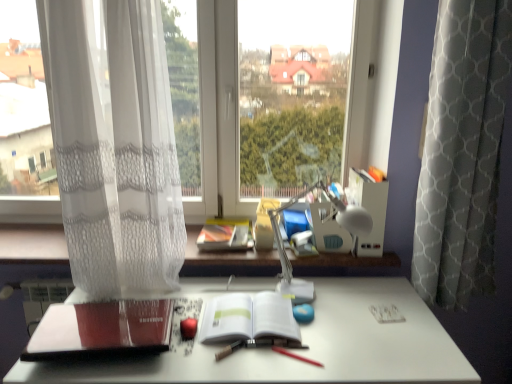
Image resolution: width=512 pixels, height=384 pixels. What do you see at coordinates (303, 351) in the screenshot?
I see `white matte desk at center` at bounding box center [303, 351].

I want to click on gray textured curtain at right, marked as the 1th curtain in a right-to-left arrangement, so click(462, 151).

What do you see at coordinates (462, 151) in the screenshot?
I see `gray textured curtain at right, marked as the 1th curtain in a right-to-left arrangement` at bounding box center [462, 151].

Describe the element at coordinates (339, 225) in the screenshot. I see `white plastic table lamp at center` at that location.

Describe the element at coordinates (218, 113) in the screenshot. The image size is (512, 384). I see `transparent glass window at center` at that location.

Locate an element on the screen. The width and height of the screenshot is (512, 384). white matte desk at center is located at coordinates (303, 351).

From a real-world perspective, between white plastic table lamp at center and gray textured curtain at right, marked as the 1th curtain in a right-to-left arrangement, who is vertically lower?

white plastic table lamp at center.

Is gray textured curtain at right, which is counted as the second curtain, starting from the left, located within white plastic table lamp at center?

That's incorrect, gray textured curtain at right, which is counted as the second curtain, starting from the left, is not inside white plastic table lamp at center.

Image resolution: width=512 pixels, height=384 pixels. I want to click on curtain that is the 1st one when counting upward from the white plastic table lamp at center (from the image's perspective), so click(x=462, y=151).

From a real-world perspective, does red matte book at lower left, positioned as the 1th paperback book in left-to-right order, sit lower than white sheer curtain at left, positioned as the first curtain in left-to-right order?

Correct, in the physical world, red matte book at lower left, positioned as the 1th paperback book in left-to-right order, is lower than white sheer curtain at left, positioned as the first curtain in left-to-right order.

Between red matte book at lower left, positioned as the 1th paperback book in left-to-right order, and white sheer curtain at left, positioned as the first curtain in left-to-right order, which one has larger width?

red matte book at lower left, positioned as the 1th paperback book in left-to-right order, is wider.

Do you think red matte book at lower left, positioned as the 1th paperback book in left-to-right order, is within white sheer curtain at left, positioned as the first curtain in left-to-right order, or outside of it?

The correct answer is: outside.

Considering the relative positions of red matte book at lower left, marked as the 2th paperback book in a right-to-left arrangement, and white sheer curtain at left, positioned as the first curtain in left-to-right order, in the image provided, is red matte book at lower left, marked as the 2th paperback book in a right-to-left arrangement, behind white sheer curtain at left, positioned as the first curtain in left-to-right order,?

No, red matte book at lower left, marked as the 2th paperback book in a right-to-left arrangement, is closer to the camera.

From a real-world perspective, is white matte desk at center above or below smooth red crayon at center?

In terms of real-world spatial position, white matte desk at center is below smooth red crayon at center.

Is white matte desk at center facing towards smooth red crayon at center?

No, white matte desk at center is not aimed at smooth red crayon at center.

Is point (80, 292) positioned behind point (301, 356)?

Yes, point (80, 292) is farther from viewer.

In the scene shown: Between white matte desk at center and smooth red crayon at center, which one has larger width?

white matte desk at center.

The height and width of the screenshot is (384, 512). Find the location of `table lamp lying above the white paper at center, placed as the 1th paperback book when sorted from right to left (from the image's perspective)`. table lamp lying above the white paper at center, placed as the 1th paperback book when sorted from right to left (from the image's perspective) is located at coordinates (339, 225).

From the image's perspective, who appears lower, white paper at center, placed as the 1th paperback book when sorted from right to left, or white plastic table lamp at center?

white paper at center, placed as the 1th paperback book when sorted from right to left, appears lower in the image.

Is point (273, 296) behind point (332, 195)?

No, (273, 296) is in front of (332, 195).

Can you tell me how much white paper at center, marked as the 2th paperback book in a left-to-right arrangement, and white plastic table lamp at center differ in facing direction?

The angular difference between white paper at center, marked as the 2th paperback book in a left-to-right arrangement, and white plastic table lamp at center is 0.971 degrees.

Is transparent glass window at center facing towards red matte book at lower left, positioned as the 1th paperback book in left-to-right order?

Yes, transparent glass window at center is facing red matte book at lower left, positioned as the 1th paperback book in left-to-right order.

Which is closer, (x=211, y=23) or (x=113, y=332)?

Point (x=211, y=23) is farther from the camera than point (x=113, y=332).

Is transparent glass window at center at the left side of red matte book at lower left, positioned as the 1th paperback book in left-to-right order?

In fact, transparent glass window at center is to the right of red matte book at lower left, positioned as the 1th paperback book in left-to-right order.

Based on the photo, are transparent glass window at center and red matte book at lower left, marked as the 2th paperback book in a right-to-left arrangement, far apart?

They are positioned close to each other.

Is gray textured curtain at right, marked as the 1th curtain in a right-to-left arrangement, oriented away from smooth red crayon at center?

That's not correct — gray textured curtain at right, marked as the 1th curtain in a right-to-left arrangement, is not looking away from smooth red crayon at center.

Does gray textured curtain at right, marked as the 1th curtain in a right-to-left arrangement, have a larger size compared to smooth red crayon at center?

Correct, gray textured curtain at right, marked as the 1th curtain in a right-to-left arrangement, is larger in size than smooth red crayon at center.

Would you consider gray textured curtain at right, marked as the 1th curtain in a right-to-left arrangement, to be distant from smooth red crayon at center?

That's not correct — gray textured curtain at right, marked as the 1th curtain in a right-to-left arrangement, is a little close to smooth red crayon at center.

Based on the photo, which object is closer to the camera taking this photo, gray textured curtain at right, which is counted as the second curtain, starting from the left, or smooth red crayon at center?

gray textured curtain at right, which is counted as the second curtain, starting from the left.

Is white paper at center, placed as the 1th paperback book when sorted from right to left, not inside red matte book at lower left, marked as the 2th paperback book in a right-to-left arrangement?

white paper at center, placed as the 1th paperback book when sorted from right to left, is positioned outside red matte book at lower left, marked as the 2th paperback book in a right-to-left arrangement.

Does point (208, 310) come farther from viewer compared to point (78, 356)?

Yes, point (208, 310) is farther from viewer.

Image resolution: width=512 pixels, height=384 pixels. Identify the location of paperback book below the red matte book at lower left, marked as the 2th paperback book in a right-to-left arrangement (from a real-world perspective). (249, 318).

Are white paper at center, placed as the 1th paperback book when sorted from right to left, and red matte book at lower left, marked as the 2th paperback book in a right-to-left arrangement, making contact?

No, white paper at center, placed as the 1th paperback book when sorted from right to left, is not next to red matte book at lower left, marked as the 2th paperback book in a right-to-left arrangement.

You are a GUI agent. You are given a task and a screenshot of the screen. Output one action in this format:
    pyautogui.click(x=<x>, y=<y>)
    Task: Click on the 1st curtain located above the white plastic table lamp at center (from a real-world perspective)
    
    Given the screenshot: What is the action you would take?
    pyautogui.click(x=462, y=151)

At what (x,y) coordinates should I click in order to perform the action: click on the 1st curtain to the right when counting from the red matte book at lower left, marked as the 2th paperback book in a right-to-left arrangement. Please return your answer as a coordinate pair (x, y). The height and width of the screenshot is (384, 512). Looking at the image, I should click on (114, 144).

From the image, which object appears to be nearer to white paper at center, marked as the 2th paperback book in a left-to-right arrangement, white sheer curtain at left, the second curtain from the right, or white plastic table lamp at center?

Based on the image, white plastic table lamp at center appears to be nearer to white paper at center, marked as the 2th paperback book in a left-to-right arrangement.

Considering their positions, is white matte desk at center positioned closer to white paper at center, marked as the 2th paperback book in a left-to-right arrangement, than white plastic table lamp at center?

white matte desk at center is closer to white paper at center, marked as the 2th paperback book in a left-to-right arrangement.

Looking at the image, which one is located closer to smooth red crayon at center, white plastic table lamp at center or transparent glass window at center?

Among the two, white plastic table lamp at center is located nearer to smooth red crayon at center.

Considering their positions, is gray textured curtain at right, marked as the 1th curtain in a right-to-left arrangement, positioned further to transparent glass window at center than red matte book at lower left, positioned as the 1th paperback book in left-to-right order?

Among the two, gray textured curtain at right, marked as the 1th curtain in a right-to-left arrangement, is located further to transparent glass window at center.

Looking at the image, which one is located closer to white paper at center, placed as the 1th paperback book when sorted from right to left, white sheer curtain at left, the second curtain from the right, or gray textured curtain at right, which is counted as the second curtain, starting from the left?

Among the two, white sheer curtain at left, the second curtain from the right, is located nearer to white paper at center, placed as the 1th paperback book when sorted from right to left.

Considering their positions, is smooth red crayon at center positioned closer to transparent glass window at center than white paper at center, marked as the 2th paperback book in a left-to-right arrangement?

white paper at center, marked as the 2th paperback book in a left-to-right arrangement.

Based on their spatial positions, is transparent glass window at center or white matte desk at center closer to white paper at center, placed as the 1th paperback book when sorted from right to left?

white matte desk at center lies closer to white paper at center, placed as the 1th paperback book when sorted from right to left, than the other object.

Estimate the real-world distances between objects in this image. Which object is closer to red matte book at lower left, positioned as the 1th paperback book in left-to-right order, white plastic table lamp at center or white paper at center, placed as the 1th paperback book when sorted from right to left?

white paper at center, placed as the 1th paperback book when sorted from right to left, lies closer to red matte book at lower left, positioned as the 1th paperback book in left-to-right order, than the other object.

What are the coordinates of `desk located between red matte book at lower left, positioned as the 1th paperback book in left-to-right order, and gray textured curtain at right, marked as the 1th curtain in a right-to-left arrangement, in the left-right direction` in the screenshot? It's located at (303, 351).

This screenshot has height=384, width=512. I want to click on desk between white sheer curtain at left, the second curtain from the right, and gray textured curtain at right, marked as the 1th curtain in a right-to-left arrangement, from left to right, so click(x=303, y=351).

Identify the location of crayon situated between red matte book at lower left, positioned as the 1th paperback book in left-to-right order, and white plastic table lamp at center from left to right. This screenshot has width=512, height=384. (296, 356).

The height and width of the screenshot is (384, 512). What are the coordinates of `table lamp between transparent glass window at center and gray textured curtain at right, marked as the 1th curtain in a right-to-left arrangement, in the horizontal direction` in the screenshot? It's located at (x=339, y=225).